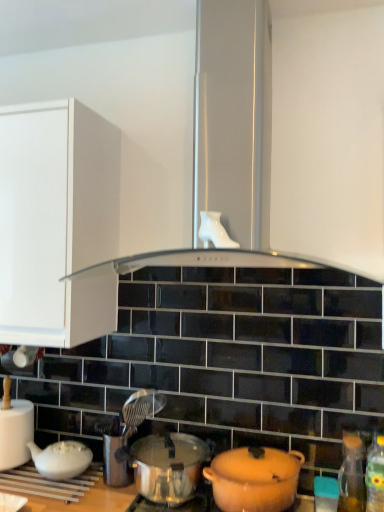
Question: Is shiny silver pot at center, arranged as the first pot/pan when viewed from the left, inside the boundaries of green plastic bottle at lower right, the second bottle positioned from the back, or outside?

Choices:
 (A) outside
 (B) inside

Answer: (A)

Question: From the image's perspective, is shiny silver pot at center, arranged as the first pot/pan when viewed from the left, positioned above or below green plastic bottle at lower right, which is the first bottle in front-to-back order?

Choices:
 (A) above
 (B) below

Answer: (B)

Question: Estimate the real-world distances between objects in this image. Which object is closer to the shiny silver pot at center, arranged as the 2th pot/pan when viewed from the right?

Choices:
 (A) transparent glass bottle at lower right, which ranks as the 2th bottle in front-to-back order
 (B) matte orange pot at lower center, positioned as the 2th pot/pan in left-to-right order
 (C) black glass exhaust hood at center
 (D) white matte teapot at lower left
 (E) teal plastic container at lower right

Answer: (B)

Question: Which object is the closest to the white matte teapot at lower left?

Choices:
 (A) teal plastic container at lower right
 (B) green plastic bottle at lower right, the second bottle positioned from the back
 (C) black glass exhaust hood at center
 (D) shiny silver pot at center, arranged as the 2th pot/pan when viewed from the right
 (E) transparent glass bottle at lower right, which ranks as the 2th bottle in front-to-back order

Answer: (D)